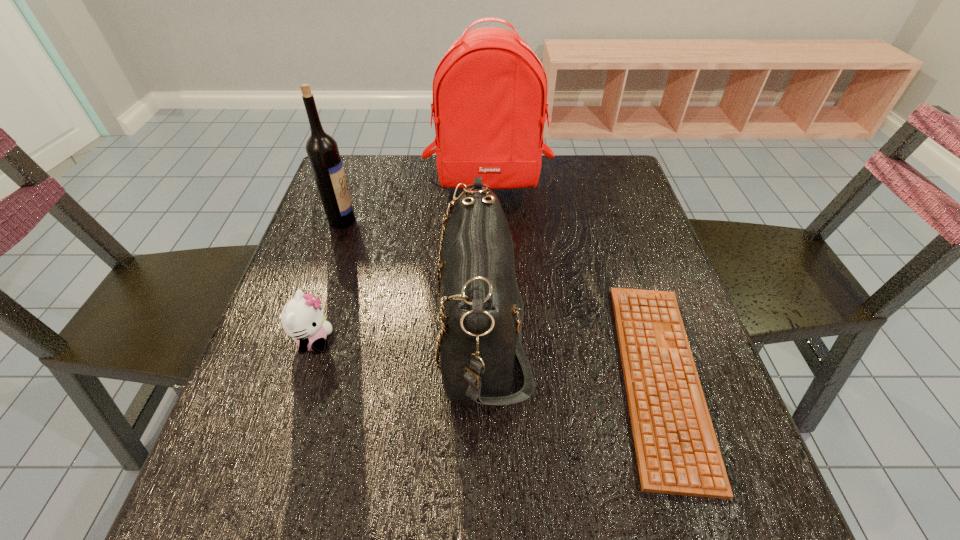
Locate an element on the screen. This screenshot has width=960, height=540. backpack is located at coordinates (489, 93).

The height and width of the screenshot is (540, 960). What are the coordinates of `the tallest object` in the screenshot? It's located at (489, 93).

The image size is (960, 540). Find the location of `the fourth shortest object`. the fourth shortest object is located at coordinates pos(322,150).

At what (x,y) coordinates should I click in order to perform the action: click on the fourth nearest object. Please return your answer as a coordinate pair (x, y). Looking at the image, I should click on (322, 150).

At what (x,y) coordinates should I click in order to perform the action: click on handbag. Please return your answer as a coordinate pair (x, y). The image size is (960, 540). Looking at the image, I should click on (481, 310).

At what (x,y) coordinates should I click in order to perform the action: click on kitten. Please return your answer as a coordinate pair (x, y). This screenshot has width=960, height=540. Looking at the image, I should click on (302, 318).

The width and height of the screenshot is (960, 540). I want to click on the rightmost object, so click(x=677, y=451).

At what (x,y) coordinates should I click in order to perform the action: click on the shortest object. Please return your answer as a coordinate pair (x, y). The width and height of the screenshot is (960, 540). Looking at the image, I should click on (677, 451).

Find the location of a particular element. blank space located 0.360m on the main compartment of the backpack is located at coordinates (491, 312).

Where is `vacant point located 0.380m on the label of the wine bottle`? vacant point located 0.380m on the label of the wine bottle is located at coordinates (503, 220).